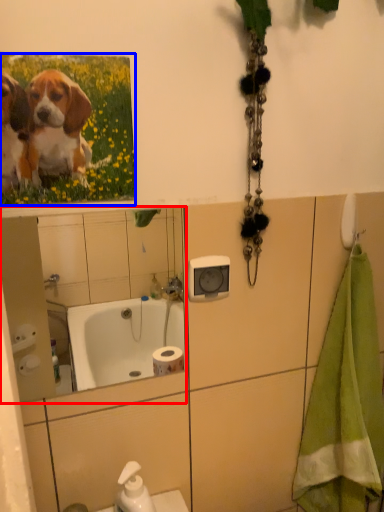
Question: Among these objects, which one is nearest to the camera, mirror (highlighted by a red box) or flower (highlighted by a blue box)?

Choices:
 (A) mirror
 (B) flower

Answer: (B)